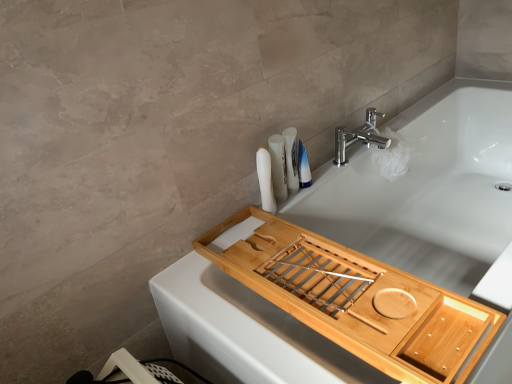
In order to face white matte toothbrushes at upper right, arranged as the 2th toiletry when viewed from the right, should I rotate leftwards or rightwards?

You should rotate right by 3.072 degrees.

Locate an element on the screen. blue glossy bottle at upper right, which ranks as the 3th toiletry in left-to-right order is located at coordinates (303, 167).

Measure the distance between blue glossy bottle at upper right, which ranks as the 3th toiletry in left-to-right order, and camera.

blue glossy bottle at upper right, which ranks as the 3th toiletry in left-to-right order, and camera are 1.31 meters apart from each other.

Where is `white matte bathtub at upper center`? The image size is (512, 384). white matte bathtub at upper center is located at coordinates (426, 190).

In order to face chrome/metallic faucet at upper right, should I rotate leftwards or rightwards?

Turn right approximately 14.961 degrees to face it.

Looking at this image, what is the approximate width of chrome/metallic faucet at upper right?

chrome/metallic faucet at upper right is 7.30 inches wide.

This screenshot has width=512, height=384. In order to click on natural wood tray at upper right in this screenshot , I will do `click(357, 301)`.

What do you see at coordinates (265, 180) in the screenshot?
I see `white matte tube at upper right, the 1th toiletry positioned from the left` at bounding box center [265, 180].

Where is `white matte toothbrushes at upper right, positioned as the 2th toiletry in left-to-right order`? The width and height of the screenshot is (512, 384). white matte toothbrushes at upper right, positioned as the 2th toiletry in left-to-right order is located at coordinates (278, 167).

Identify the location of bathtub that is below the chrome/metallic faucet at upper right (from the image's perspective). (426, 190).

Would you consider chrome/metallic faucet at upper right to be distant from white matte bathtub at upper center?

No, chrome/metallic faucet at upper right is in close proximity to white matte bathtub at upper center.

Looking at this image, how many degrees apart are the facing directions of chrome/metallic faucet at upper right and white matte bathtub at upper center?

There is a 1.19-degree angle between the facing directions of chrome/metallic faucet at upper right and white matte bathtub at upper center.

Is chrome/metallic faucet at upper right behind white matte bathtub at upper center?

Yes.

Is white matte bathtub at upper center oriented towards white matte tube at upper right, the 3th toiletry from the right?

No, white matte bathtub at upper center is not aimed at white matte tube at upper right, the 3th toiletry from the right.

Does white matte bathtub at upper center lie behind white matte tube at upper right, the 3th toiletry from the right?

No.

Is white matte bathtub at upper center not within white matte tube at upper right, the 3th toiletry from the right?

white matte bathtub at upper center lies outside white matte tube at upper right, the 3th toiletry from the right,'s area.

Which point is more forward, [324,220] or [267,176]?

Point [267,176]

In terms of width, does white matte toothbrushes at upper right, positioned as the 2th toiletry in left-to-right order, look wider or thinner when compared to blue glossy bottle at upper right, which appears as the first toiletry when viewed from the right?

Considering their sizes, white matte toothbrushes at upper right, positioned as the 2th toiletry in left-to-right order, looks broader than blue glossy bottle at upper right, which appears as the first toiletry when viewed from the right.

Which object is positioned more to the right, white matte toothbrushes at upper right, arranged as the 2th toiletry when viewed from the right, or blue glossy bottle at upper right, which appears as the first toiletry when viewed from the right?

Positioned to the right is blue glossy bottle at upper right, which appears as the first toiletry when viewed from the right.

From the image's perspective, which is above, white matte toothbrushes at upper right, positioned as the 2th toiletry in left-to-right order, or blue glossy bottle at upper right, which appears as the first toiletry when viewed from the right?

blue glossy bottle at upper right, which appears as the first toiletry when viewed from the right, is shown above in the image.

Which object is closer to the camera taking this photo, white matte toothbrushes at upper right, arranged as the 2th toiletry when viewed from the right, or blue glossy bottle at upper right, which appears as the first toiletry when viewed from the right?

white matte toothbrushes at upper right, arranged as the 2th toiletry when viewed from the right, is more forward.

Is chrome/metallic faucet at upper right in front of white matte toothbrushes at upper right, positioned as the 2th toiletry in left-to-right order?

No.

How different are the orientations of chrome/metallic faucet at upper right and white matte toothbrushes at upper right, arranged as the 2th toiletry when viewed from the right, in degrees?

chrome/metallic faucet at upper right and white matte toothbrushes at upper right, arranged as the 2th toiletry when viewed from the right, are facing 3.41 degrees away from each other.

Which of these two, chrome/metallic faucet at upper right or white matte toothbrushes at upper right, arranged as the 2th toiletry when viewed from the right, is thinner?

white matte toothbrushes at upper right, arranged as the 2th toiletry when viewed from the right, is thinner.

Is natural wood tray at upper right looking in the opposite direction of blue glossy bottle at upper right, which appears as the first toiletry when viewed from the right?

natural wood tray at upper right does not have its back to blue glossy bottle at upper right, which appears as the first toiletry when viewed from the right.

From the natural wood tray at upper right, count 3rd toiletrys backward and point to it. Please provide its 2D coordinates.

[(303, 167)]

In the image, is natural wood tray at upper right positioned in front of or behind blue glossy bottle at upper right, which ranks as the 3th toiletry in left-to-right order?

Clearly, natural wood tray at upper right is in front of blue glossy bottle at upper right, which ranks as the 3th toiletry in left-to-right order.

From a real-world perspective, is natural wood tray at upper right positioned over blue glossy bottle at upper right, which appears as the first toiletry when viewed from the right, based on gravity?

Incorrect, from a real-world perspective, natural wood tray at upper right is lower than blue glossy bottle at upper right, which appears as the first toiletry when viewed from the right.

Which is correct: white matte tube at upper right, the 1th toiletry positioned from the left, is inside blue glossy bottle at upper right, which appears as the first toiletry when viewed from the right, or outside of it?

white matte tube at upper right, the 1th toiletry positioned from the left, is outside blue glossy bottle at upper right, which appears as the first toiletry when viewed from the right.

Which of these two, white matte tube at upper right, the 3th toiletry from the right, or blue glossy bottle at upper right, which appears as the first toiletry when viewed from the right, is thinner?

blue glossy bottle at upper right, which appears as the first toiletry when viewed from the right, is thinner.

Is there a large distance between white matte tube at upper right, the 3th toiletry from the right, and blue glossy bottle at upper right, which appears as the first toiletry when viewed from the right?

No, there isn't a large distance between white matte tube at upper right, the 3th toiletry from the right, and blue glossy bottle at upper right, which appears as the first toiletry when viewed from the right.

From a real-world perspective, which toiletry is the 2nd one underneath the white matte tube at upper right, the 1th toiletry positioned from the left? Please provide its 2D coordinates.

[(303, 167)]

From the picture: Choose the correct answer: Is white matte bathtub at upper center inside blue glossy bottle at upper right, which appears as the first toiletry when viewed from the right, or outside it?

white matte bathtub at upper center exists outside the volume of blue glossy bottle at upper right, which appears as the first toiletry when viewed from the right.

From a real-world perspective, is white matte bathtub at upper center located beneath blue glossy bottle at upper right, which ranks as the 3th toiletry in left-to-right order?

Yes, from a real-world perspective, white matte bathtub at upper center is under blue glossy bottle at upper right, which ranks as the 3th toiletry in left-to-right order.

Between white matte bathtub at upper center and blue glossy bottle at upper right, which ranks as the 3th toiletry in left-to-right order, which one has less height?

blue glossy bottle at upper right, which ranks as the 3th toiletry in left-to-right order, is shorter.

Between white matte bathtub at upper center and blue glossy bottle at upper right, which appears as the first toiletry when viewed from the right, which one has larger width?

white matte bathtub at upper center is wider.

Identify the location of bathtub on the right of chrome/metallic faucet at upper right. (426, 190).

From the image's perspective, count 1st toiletrys upward from the white matte bathtub at upper center and point to it. Please provide its 2D coordinates.

[(265, 180)]

Estimate the real-world distances between objects in this image. Which object is closer to white matte toothbrushes at upper right, arranged as the 2th toiletry when viewed from the right, white matte tube at upper right, the 3th toiletry from the right, or natural wood tray at upper right?

white matte tube at upper right, the 3th toiletry from the right, is closer to white matte toothbrushes at upper right, arranged as the 2th toiletry when viewed from the right.

Considering their positions, is white matte bathtub at upper center positioned closer to white matte toothbrushes at upper right, arranged as the 2th toiletry when viewed from the right, than blue glossy bottle at upper right, which appears as the first toiletry when viewed from the right?

Among the two, blue glossy bottle at upper right, which appears as the first toiletry when viewed from the right, is located nearer to white matte toothbrushes at upper right, arranged as the 2th toiletry when viewed from the right.

Considering their positions, is blue glossy bottle at upper right, which appears as the first toiletry when viewed from the right, positioned closer to natural wood tray at upper right than white matte bathtub at upper center?

Based on the image, white matte bathtub at upper center appears to be nearer to natural wood tray at upper right.

When comparing their distances from white matte tube at upper right, the 3th toiletry from the right, does white matte bathtub at upper center or blue glossy bottle at upper right, which ranks as the 3th toiletry in left-to-right order, seem closer?

blue glossy bottle at upper right, which ranks as the 3th toiletry in left-to-right order.

Based on their spatial positions, is white matte bathtub at upper center or white matte toothbrushes at upper right, arranged as the 2th toiletry when viewed from the right, closer to white matte tube at upper right, the 3th toiletry from the right?

Based on the image, white matte toothbrushes at upper right, arranged as the 2th toiletry when viewed from the right, appears to be nearer to white matte tube at upper right, the 3th toiletry from the right.

Based on their spatial positions, is white matte bathtub at upper center or natural wood tray at upper right further from chrome/metallic faucet at upper right?

natural wood tray at upper right is positioned further to the anchor chrome/metallic faucet at upper right.

Looking at the image, which one is located closer to white matte bathtub at upper center, white matte tube at upper right, the 3th toiletry from the right, or chrome/metallic faucet at upper right?

chrome/metallic faucet at upper right lies closer to white matte bathtub at upper center than the other object.

Considering their positions, is white matte toothbrushes at upper right, positioned as the 2th toiletry in left-to-right order, positioned further to blue glossy bottle at upper right, which ranks as the 3th toiletry in left-to-right order, than natural wood tray at upper right?

natural wood tray at upper right.

Locate an element on the screen. The image size is (512, 384). toiletry located between white matte toothbrushes at upper right, positioned as the 2th toiletry in left-to-right order, and chrome/metallic faucet at upper right in the left-right direction is located at coordinates (303, 167).

Identify the location of tray between white matte bathtub at upper center and blue glossy bottle at upper right, which ranks as the 3th toiletry in left-to-right order, in the front-back direction. (357, 301).

Where is `tray between white matte tube at upper right, the 3th toiletry from the right, and white matte bathtub at upper center, in the horizontal direction`? This screenshot has height=384, width=512. tray between white matte tube at upper right, the 3th toiletry from the right, and white matte bathtub at upper center, in the horizontal direction is located at coordinates (357, 301).

The width and height of the screenshot is (512, 384). Identify the location of toiletry between white matte tube at upper right, the 1th toiletry positioned from the left, and blue glossy bottle at upper right, which appears as the first toiletry when viewed from the right. (278, 167).